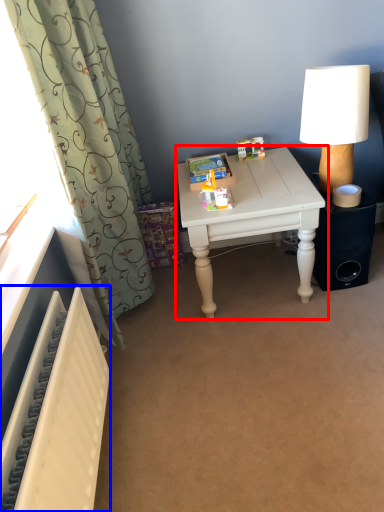
Question: Among these objects, which one is farthest to the camera, table (highlighted by a red box) or radiator (highlighted by a blue box)?

Choices:
 (A) table
 (B) radiator

Answer: (A)